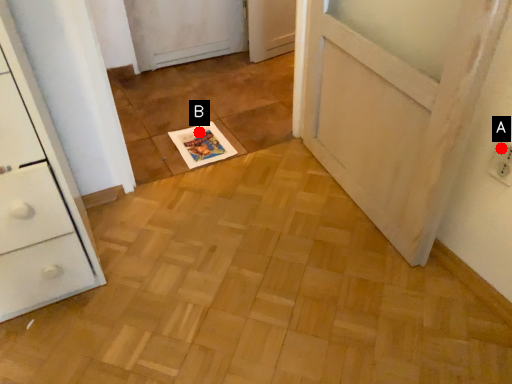
Question: Two points are circled on the image, labeled by A and B beside each circle. Which point is further to the camera?

Choices:
 (A) A is further
 (B) B is further

Answer: (B)